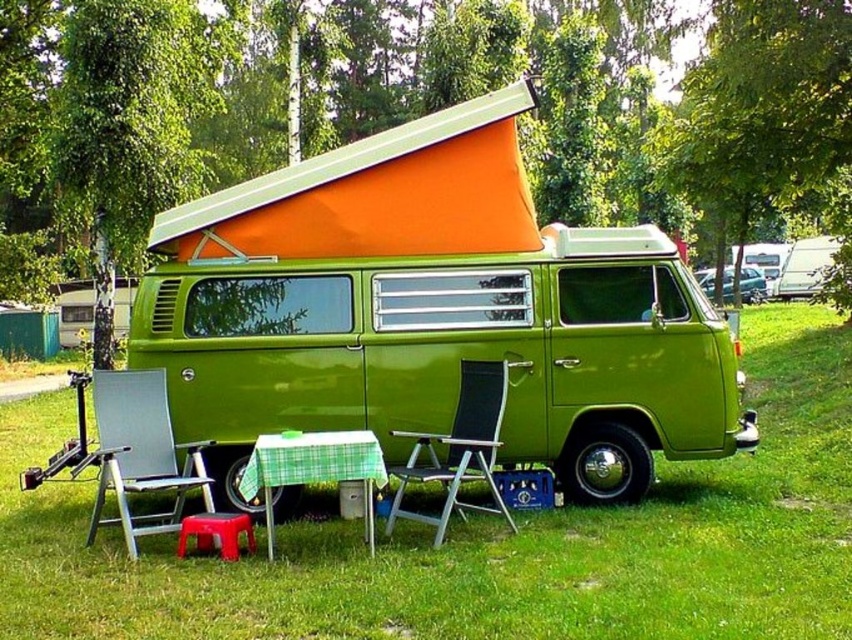
You are standing in front of the vintage camper van and want to place a small potted plant between the green grass at lower center and the black mesh chair at center. Which object should the plant be closer to based on their positions?

The green grass at lower center is closer to the viewer than the black mesh chair at center, so the plant should be placed closer to the black mesh chair at center to be between them.

You are planning to set up a tent in the area where the green grass at lower center and the black mesh chair at center are located. Which surface would be better for the tent base considering the height differences?

The green grass at lower center is shorter than the black mesh chair at center, so the grass area would be a better surface for the tent base as it is lower and more level.

You are planning to set up a tent in the area near the green grass at lower center and the black mesh chair at center. Based on their positions, which object should you place your tent closer to if you want it to be on the left side of the scene?

You should place your tent closer to the black mesh chair at center because the green grass at lower center is to the right of the black mesh chair at center, meaning the chair is on the left side relative to the grass.